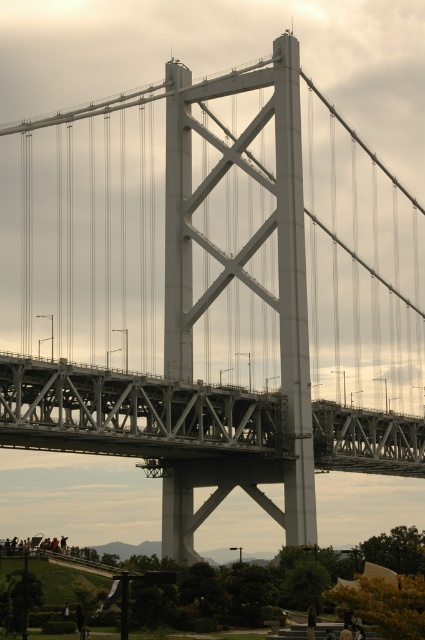
What do you see at coordinates (289, 586) in the screenshot? The height and width of the screenshot is (640, 425). I see `green grass at lower left` at bounding box center [289, 586].

This screenshot has height=640, width=425. I want to click on green grass at lower left, so [289, 586].

Which is behind, point (269, 452) or point (308, 620)?

The point (269, 452) is behind.

Between point (121, 406) and point (308, 636), which one is positioned in front?

Point (308, 636) is in front.

Identify the location of gray metallic bridge at center. The image size is (425, 640). (133, 413).

Is point (11, 364) positioned behind point (144, 586)?

No, it is in front of (144, 586).

Can you confirm if gray metallic bridge at center is positioned above green grass at lower left?

Indeed, gray metallic bridge at center is positioned over green grass at lower left.

Where is `gray metallic bridge at center`? gray metallic bridge at center is located at coordinates (133, 413).

Find the location of a particular element. Image resolution: width=425 pixels, height=640 pixels. gray metallic bridge at center is located at coordinates click(x=133, y=413).